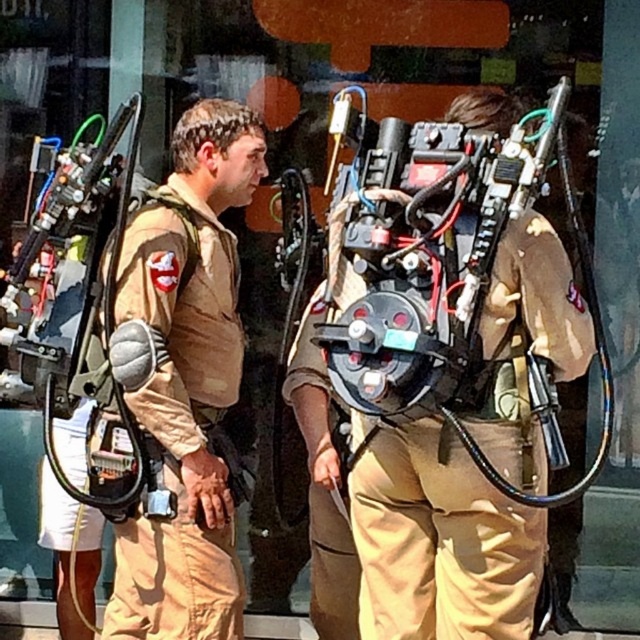
You are a Ghostbuster in the field and need to quickly access your proton pack. You see the tan fabric uniform at center and the matte black backpack at center. Which object is closer to you?

The tan fabric uniform at center is closer to you because the matte black backpack at center is positioned behind it.